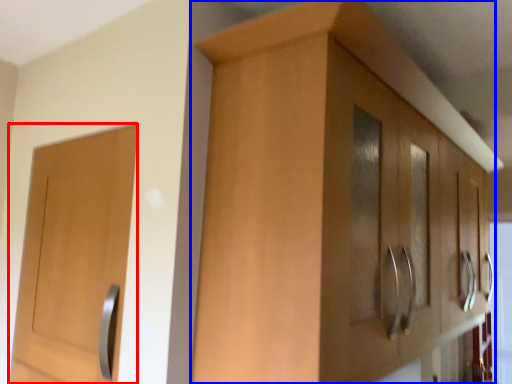
Question: Which object appears closest to the camera in this image, door (highlighted by a red box) or cabinetry (highlighted by a blue box)?

Choices:
 (A) door
 (B) cabinetry

Answer: (B)